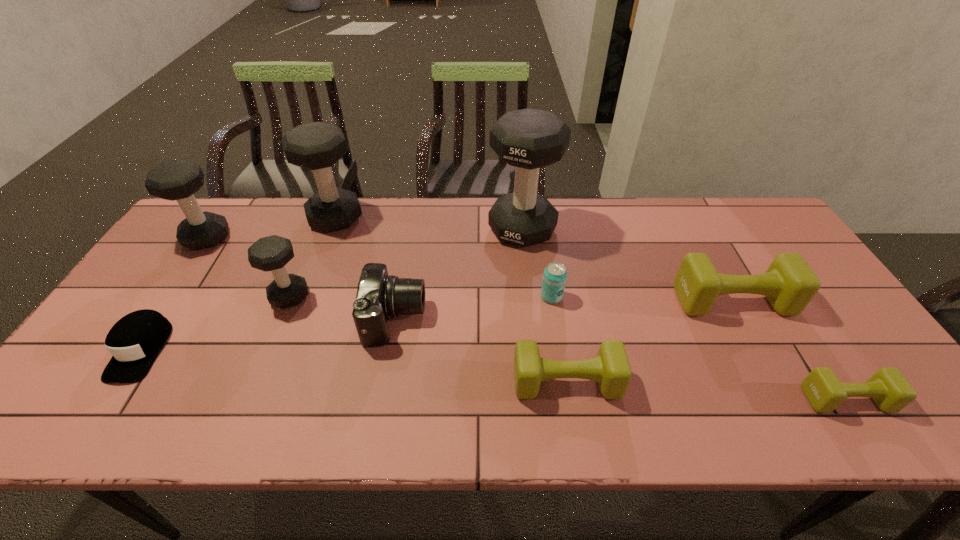
This screenshot has width=960, height=540. In order to click on vacant region at the far edge in this screenshot , I will do `click(317, 235)`.

Where is `vacant region at the near edge`? The height and width of the screenshot is (540, 960). vacant region at the near edge is located at coordinates (669, 430).

At what (x,y) coordinates should I click in order to perform the action: click on free space at the right edge of the desktop. Please return your answer as a coordinate pair (x, y). The width and height of the screenshot is (960, 540). Looking at the image, I should click on (828, 325).

Image resolution: width=960 pixels, height=540 pixels. I want to click on vacant space at the far left corner of the desktop, so click(x=211, y=202).

Find the location of a particular element. The image size is (960, 540). vacant point located between the camera and the cap is located at coordinates (268, 335).

This screenshot has width=960, height=540. What are the coordinates of `free space between the camera and the tallest object` in the screenshot? It's located at (459, 274).

I want to click on unoccupied area between the third smallest gray dumbbell and the second smallest olive dumbbell, so click(x=451, y=300).

Identify the location of unoccupied area between the second tallest object and the black cap. The width and height of the screenshot is (960, 540). (238, 284).

You are a GUI agent. You are given a task and a screenshot of the screen. Output one action in this format:
    pyautogui.click(x=<x>, y=<y>)
    Task: Click on the vacant region between the rightmost gray dumbbell and the smallest olive dumbbell
    Image resolution: width=960 pixels, height=540 pixels.
    Given the screenshot: What is the action you would take?
    pyautogui.click(x=684, y=314)

Locate an element on the screen. This screenshot has height=540, width=960. free space between the beer can and the sixth tallest dumbbell is located at coordinates (559, 339).